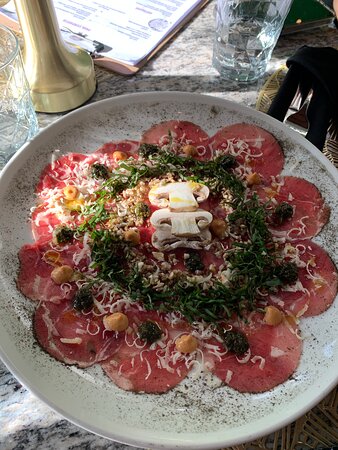
Where is `base of light`? This screenshot has width=338, height=450. base of light is located at coordinates (63, 88).